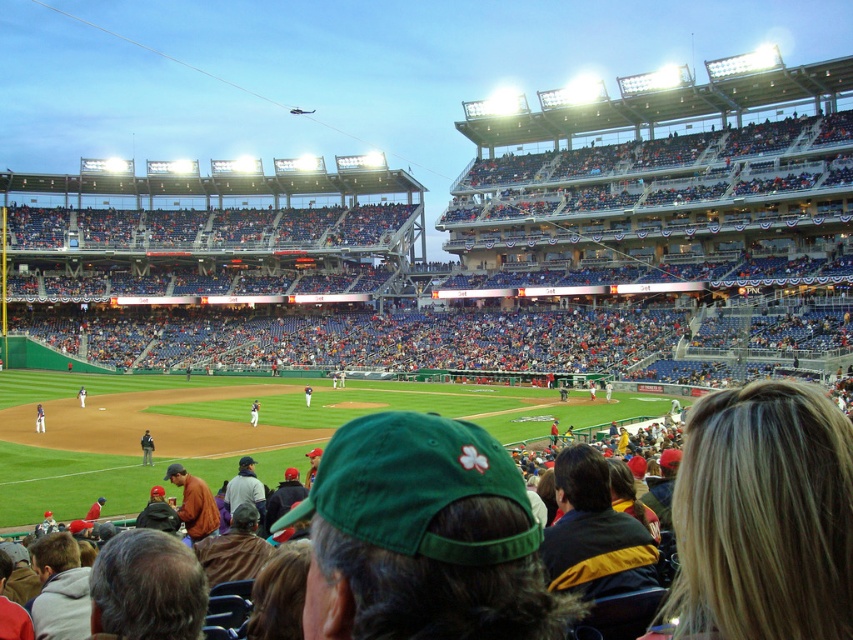
Based on the photo, can you confirm if dark gray uniform at center is wider than white uniform at center?

No, dark gray uniform at center is not wider than white uniform at center.

Which is behind, point (140, 445) or point (80, 394)?

Point (80, 394)

I want to click on dark gray uniform at center, so click(146, 448).

Who is positioned more to the left, dark gray uniform at center or white jersey at center?

From the viewer's perspective, white jersey at center appears more on the left side.

Can you confirm if dark gray uniform at center is thinner than white jersey at center?

Yes, dark gray uniform at center is thinner than white jersey at center.

Which is in front, point (148, 445) or point (38, 432)?

Point (148, 445)

Locate an element on the screen. dark gray uniform at center is located at coordinates (146, 448).

Is white jersey at center further to the viewer compared to white uniform at center?

No, it is not.

Measure the distance between point (41, 410) and camera.

The distance of point (41, 410) from camera is 83.50 meters.

Identify the location of white jersey at center. (39, 419).

I want to click on white jersey at center, so click(x=39, y=419).